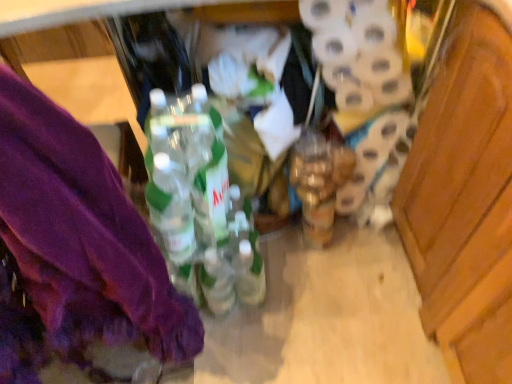
Question: Is the surface of white matte toilet paper at center right in direct contact with translucent plastic bottles at center?

Choices:
 (A) yes
 (B) no

Answer: (B)

Question: Is white matte toilet paper at center right positioned behind translucent plastic bottles at center?

Choices:
 (A) no
 (B) yes

Answer: (B)

Question: From a real-world perspective, is white matte toilet paper at center right over translucent plastic bottles at center?

Choices:
 (A) no
 (B) yes

Answer: (B)

Question: Is white matte toilet paper at center right to the left of translucent plastic bottles at center from the viewer's perspective?

Choices:
 (A) no
 (B) yes

Answer: (A)

Question: Is white matte toilet paper at center right thinner than translucent plastic bottles at center?

Choices:
 (A) no
 (B) yes

Answer: (B)

Question: Does white matte toilet paper at center right have a greater height compared to translucent plastic bottles at center?

Choices:
 (A) yes
 (B) no

Answer: (B)

Question: Can you confirm if purple fabric at left is positioned to the left of translucent plastic bottles at center?

Choices:
 (A) yes
 (B) no

Answer: (A)

Question: From the image's perspective, is purple fabric at left on top of translucent plastic bottles at center?

Choices:
 (A) no
 (B) yes

Answer: (B)

Question: Is purple fabric at left taller than translucent plastic bottles at center?

Choices:
 (A) no
 (B) yes

Answer: (B)

Question: Is purple fabric at left completely or partially outside of translucent plastic bottles at center?

Choices:
 (A) no
 (B) yes

Answer: (B)

Question: Is purple fabric at left positioned in front of translucent plastic bottles at center?

Choices:
 (A) yes
 (B) no

Answer: (A)

Question: Is purple fabric at left to the right of translucent plastic bottles at center from the viewer's perspective?

Choices:
 (A) yes
 (B) no

Answer: (B)

Question: Can you confirm if translucent plastic bottles at center is smaller than white matte toilet paper at center right?

Choices:
 (A) no
 (B) yes

Answer: (A)